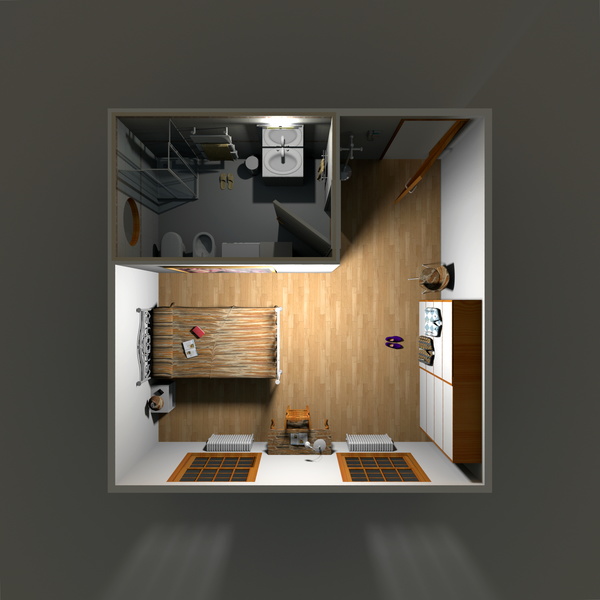
The height and width of the screenshot is (600, 600). I want to click on window, so click(378, 475), click(384, 462), click(224, 470), click(191, 455).